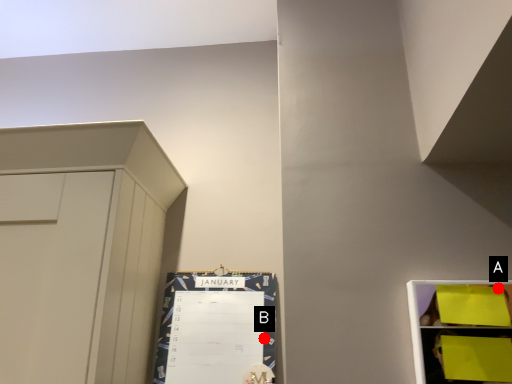
Question: Two points are circled on the image, labeled by A and B beside each circle. Which point appears closest to the camera in this image?

Choices:
 (A) A is closer
 (B) B is closer

Answer: (A)